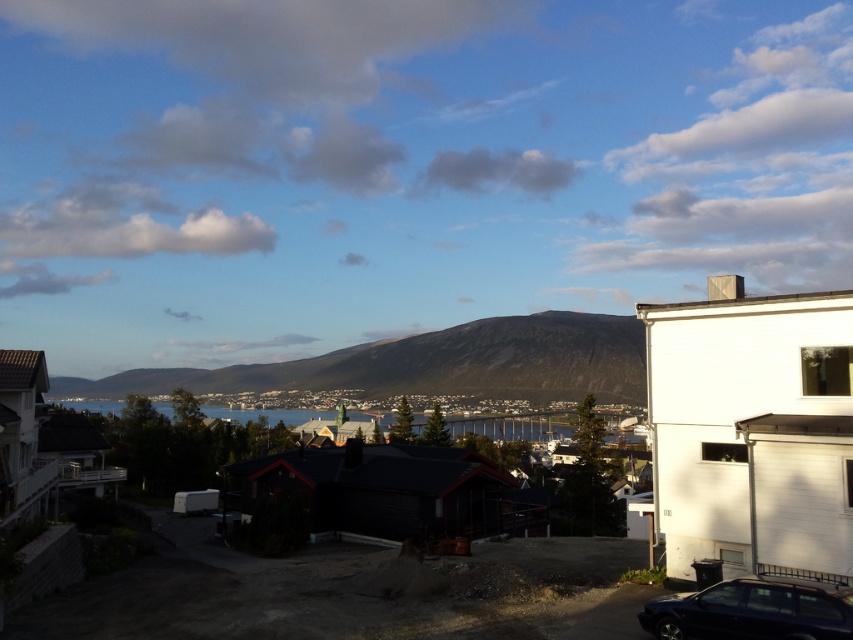
You are standing in the suburban landscape and want to place a small garden ornament. You have two points marked as potential locations. The first is at point (711, 602) and the second is at point (360, 416). Which point is closer to where you are standing?

Point (711, 602) is closer to the viewer than point (360, 416), so the ornament placed there would be nearer to your current position.

You are standing in the suburban area and want to cross to the other side of the blue water at center. Is the shiny black car at lower right blocking your path?

The shiny black car at lower right is positioned over blue water at center, so it is blocking the path to the blue water at center.